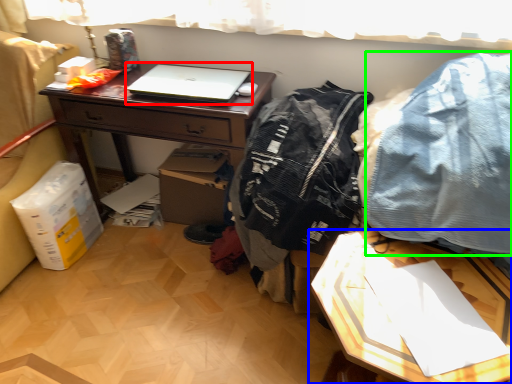
Question: Considering the real-world distances, which object is closest to laptop (highlighted by a red box)? table (highlighted by a blue box) or clothing (highlighted by a green box).

Choices:
 (A) table
 (B) clothing

Answer: (B)